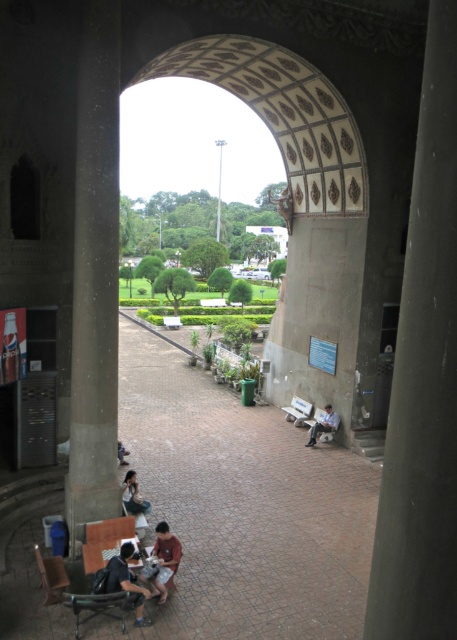
You are standing inside the archway and notice a matte black dress at lower center and a wooden park bench at center. Which object is taller?

The matte black dress at lower center is not as tall as the wooden park bench at center, so the wooden park bench at center is taller.

You are a photographer planning to take a picture of the matte black dress at lower center and the wooden park bench at center through the archway. If the dress is narrower than the bench, how does its size compare to the bench in the photo?

The matte black dress at lower center is narrower than the wooden park bench at center, so in the photo, the dress will appear smaller in width compared to the bench.

You are standing inside the archway and want to sit down on the wooden park bench at center. Which direction should you move relative to the matte black dress at lower center?

You should move to the right relative to the matte black dress at lower center because the wooden park bench at center is to the right of the matte black dress at lower center.